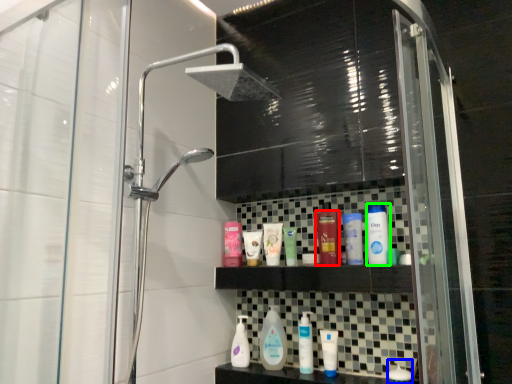
Question: Which object is the closest to the toiletry (highlighted by a red box)? Choose among these: toiletry (highlighted by a blue box) or toiletry (highlighted by a green box).

Choices:
 (A) toiletry
 (B) toiletry

Answer: (B)